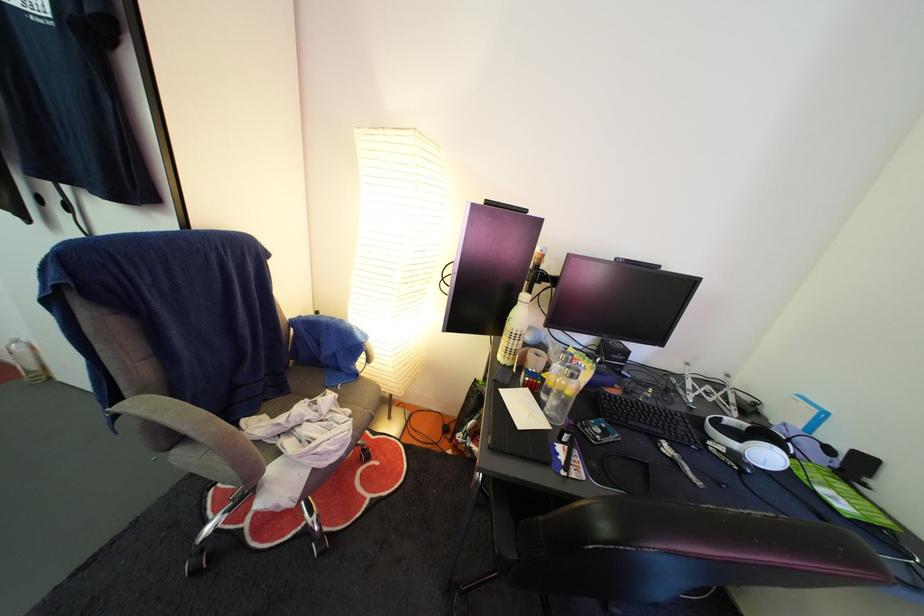
This screenshot has width=924, height=616. Identify the location of grey chair armrest. (185, 434).